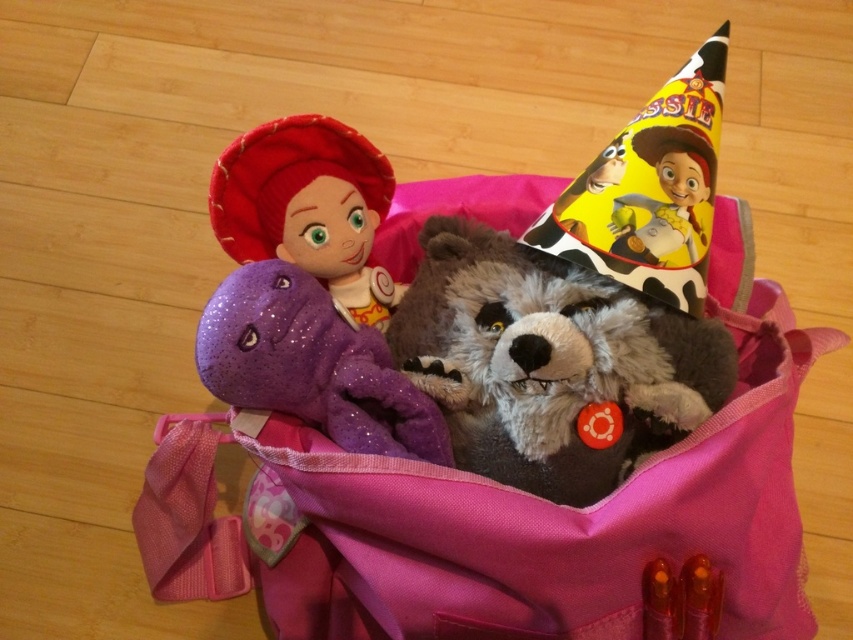
You are holding a camera and want to take a photo of the sparkly purple dinosaur at center. If the camera has a minimum focus distance of 80 centimeters, will you be able to take a clear photo?

The sparkly purple dinosaur at center and camera are 82.23 centimeters apart. Since the minimum focus distance is 80 centimeters, the camera can focus at 82.23 centimeters, so yes, you can take a clear photo.

You are organizing a Toy Story themed birthday party and need to arrange the toys in the pink tote bag. You want to place the sparkly purple dinosaur at center and the matte fabric doll at upper left in a way that follows their positions in the image. Where should you position them relative to each other?

The sparkly purple dinosaur at center should be placed below the matte fabric doll at upper left to maintain their original positions as shown in the image.